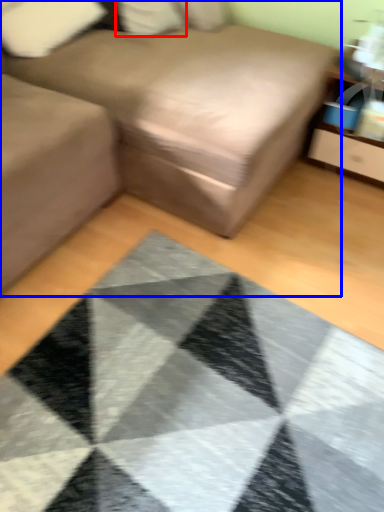
Question: Which object is closer to the camera taking this photo, pillow (highlighted by a red box) or studio couch (highlighted by a blue box)?

Choices:
 (A) pillow
 (B) studio couch

Answer: (B)